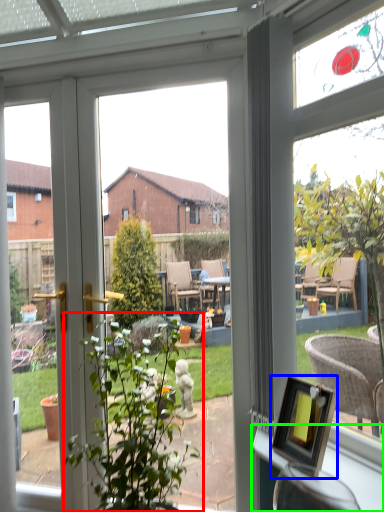
Question: Based on their relative distances, which object is farther from houseplant (highlighted by a red box)? Choose from picture frame (highlighted by a blue box) and window sill (highlighted by a green box).

Choices:
 (A) picture frame
 (B) window sill

Answer: (A)